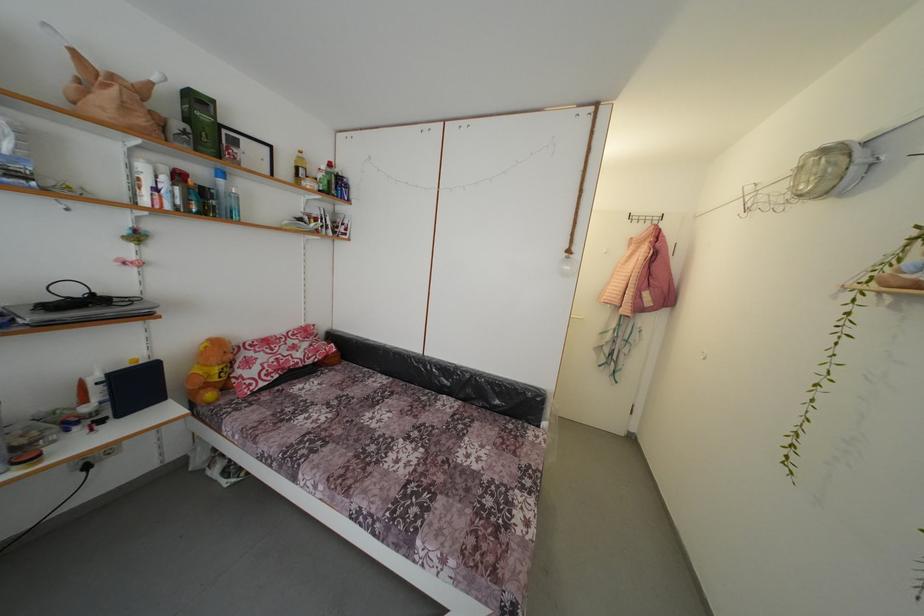
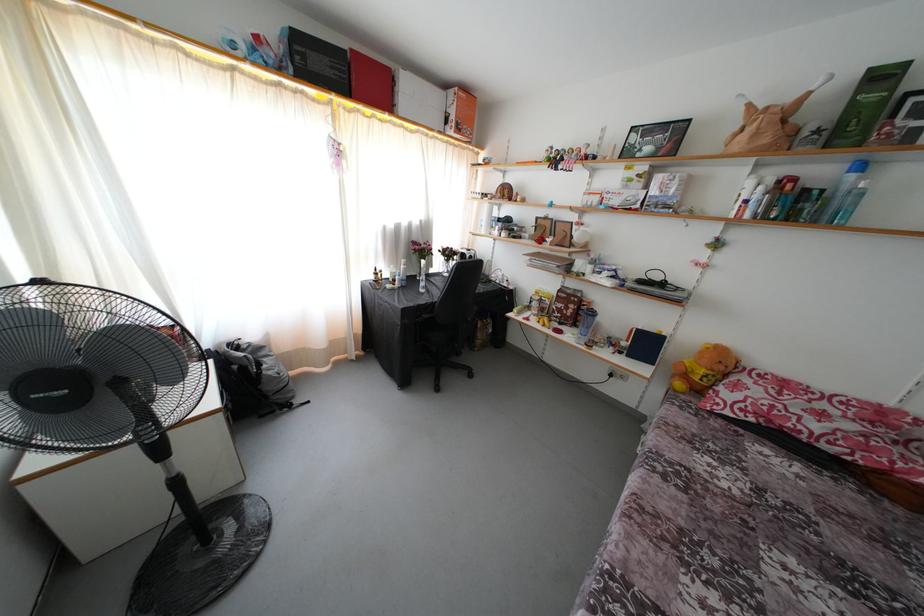
Where in the second image is the point corresponding to point (236, 362) from the first image?

(726, 373)